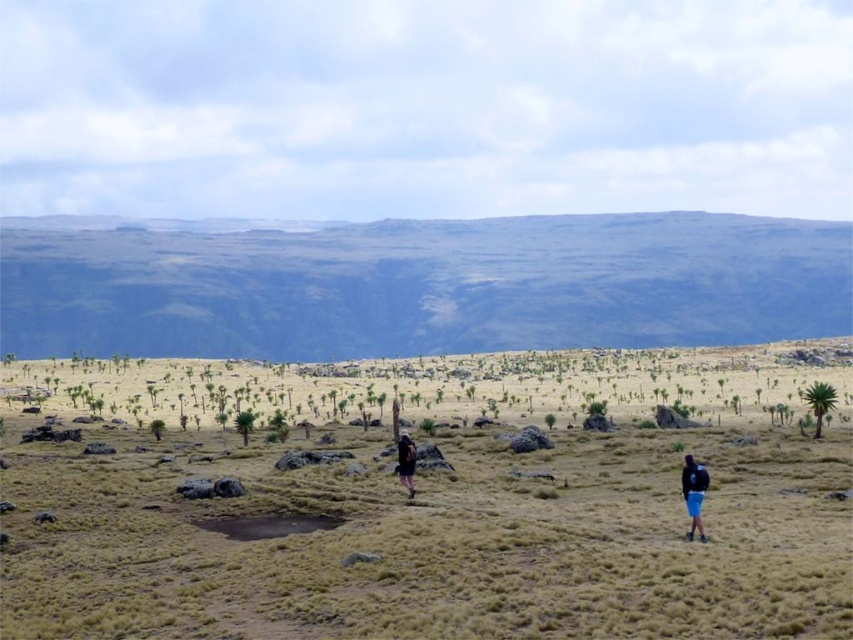
You are a hiker trying to navigate to the highest point in the area. You see the dry grassland at center and the green grassy hill at upper center. Which direction should you go to reach the highest elevation?

The dry grassland at center is positioned under green grassy hill at upper center, so the green grassy hill at upper center is higher in elevation. To reach the highest point, you should head towards the green grassy hill at upper center.

You are a hiker trying to navigate through the dry grassland at center and the black fabric backpack at center. Since both are in your path, which one will you need to step over or around first?

The dry grassland at center is larger in size than the black fabric backpack at center, so you will need to step over or around the dry grassland at center first.

You are a hiker trying to navigate through the dry terrain. You notice the green grassy hill at upper center and the black fabric backpack at center. Which object is positioned higher in the image?

The green grassy hill at upper center is located above the black fabric backpack at center, so it is positioned higher in the image.